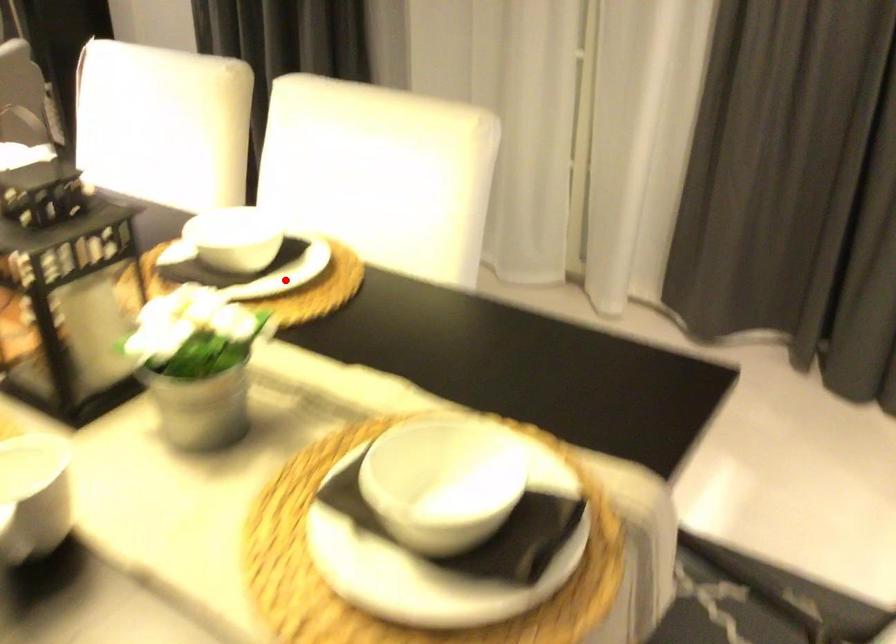
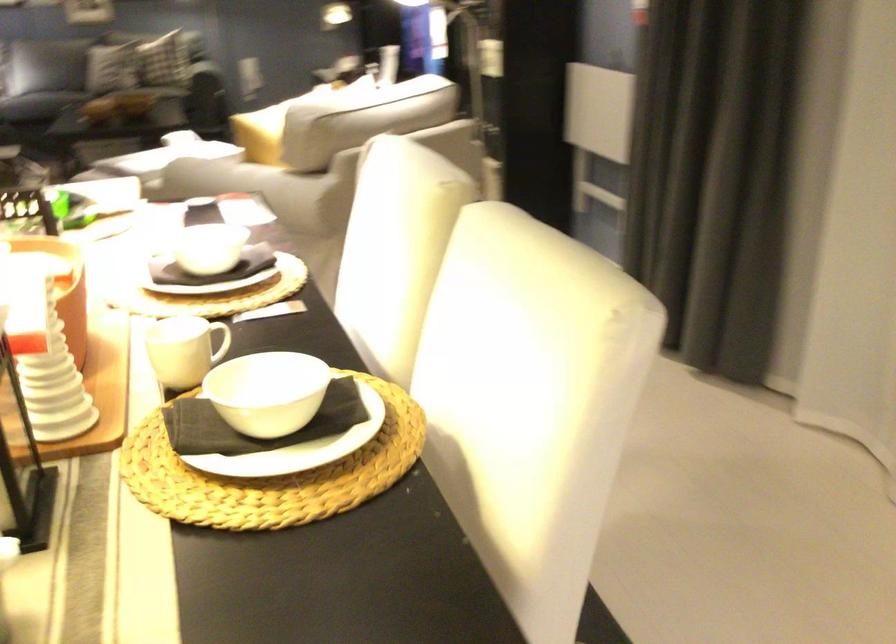
Question: A red point is marked in image1. In image2, is the corresponding 3D point closer to the camera or farther? Reply with the corresponding letter.

Choices:
 (A) The corresponding 3D point is closer.
 (B) The corresponding 3D point is farther.

Answer: (A)